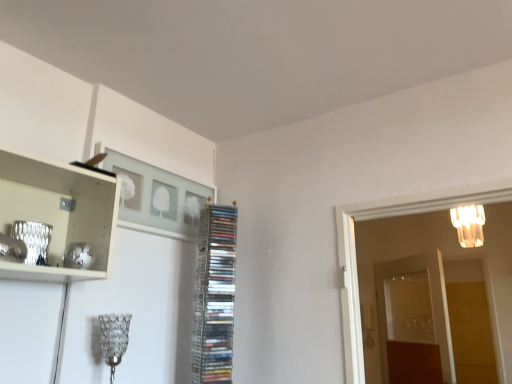
Question: Is transparent glass door at right, placed as the first glass door when sorted from right to left, in front of clear plastic rack of cds at center?

Choices:
 (A) no
 (B) yes

Answer: (A)

Question: Considering the relative sizes of transparent glass door at right, marked as the second glass door in a left-to-right arrangement, and clear plastic rack of cds at center in the image provided, is transparent glass door at right, marked as the second glass door in a left-to-right arrangement, shorter than clear plastic rack of cds at center?

Choices:
 (A) yes
 (B) no

Answer: (B)

Question: Does transparent glass door at right, marked as the second glass door in a left-to-right arrangement, appear on the left side of clear plastic rack of cds at center?

Choices:
 (A) yes
 (B) no

Answer: (B)

Question: Would you say transparent glass door at right, marked as the second glass door in a left-to-right arrangement, contains clear plastic rack of cds at center?

Choices:
 (A) no
 (B) yes

Answer: (A)

Question: Considering the relative sizes of transparent glass door at right, placed as the first glass door when sorted from right to left, and clear plastic rack of cds at center in the image provided, is transparent glass door at right, placed as the first glass door when sorted from right to left, taller than clear plastic rack of cds at center?

Choices:
 (A) yes
 (B) no

Answer: (A)

Question: Considering the positions of transparent glass door at right, placed as the first glass door when sorted from right to left, and matte gray picture frame at upper center in the image, is transparent glass door at right, placed as the first glass door when sorted from right to left, taller or shorter than matte gray picture frame at upper center?

Choices:
 (A) short
 (B) tall

Answer: (B)

Question: Considering the positions of transparent glass door at right, marked as the second glass door in a left-to-right arrangement, and matte gray picture frame at upper center in the image, is transparent glass door at right, marked as the second glass door in a left-to-right arrangement, wider or thinner than matte gray picture frame at upper center?

Choices:
 (A) wide
 (B) thin

Answer: (A)

Question: In terms of size, does transparent glass door at right, marked as the second glass door in a left-to-right arrangement, appear bigger or smaller than matte gray picture frame at upper center?

Choices:
 (A) small
 (B) big

Answer: (B)

Question: Considering the positions of point (501, 198) and point (188, 233), is point (501, 198) closer or farther from the camera than point (188, 233)?

Choices:
 (A) farther
 (B) closer

Answer: (B)

Question: Is matte gray picture frame at upper center situated inside translucent glass chandelier at upper right, arranged as the first lamp when viewed from the right, or outside?

Choices:
 (A) outside
 (B) inside

Answer: (A)

Question: From the image's perspective, is matte gray picture frame at upper center above or below translucent glass chandelier at upper right, which ranks as the 2th lamp in bottom-to-top order?

Choices:
 (A) above
 (B) below

Answer: (A)

Question: From a real-world perspective, relative to translucent glass chandelier at upper right, which ranks as the 2th lamp in bottom-to-top order, is matte gray picture frame at upper center vertically above or below?

Choices:
 (A) below
 (B) above

Answer: (A)

Question: Would you say matte gray picture frame at upper center is to the left or to the right of translucent glass chandelier at upper right, the 1th lamp from the back, in the picture?

Choices:
 (A) right
 (B) left

Answer: (B)

Question: From the image's perspective, is clear plastic rack of cds at center above or below clear glass lampshade at lower left, the second lamp when ordered from back to front?

Choices:
 (A) above
 (B) below

Answer: (A)

Question: Is clear plastic rack of cds at center in front of or behind clear glass lampshade at lower left, the 2th lamp positioned from the top, in the image?

Choices:
 (A) front
 (B) behind

Answer: (B)